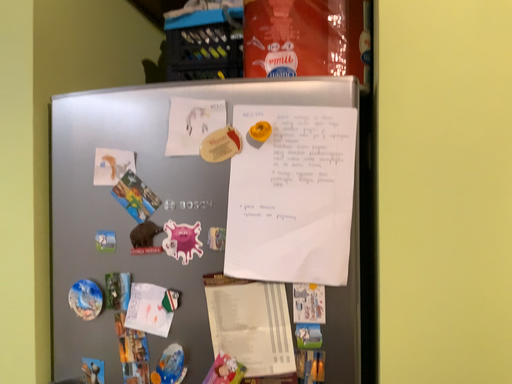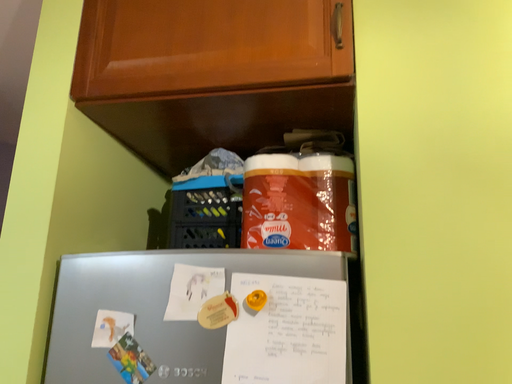
Question: Which way did the camera rotate in the video?

Choices:
 (A) rotated downward
 (B) rotated upward

Answer: (B)